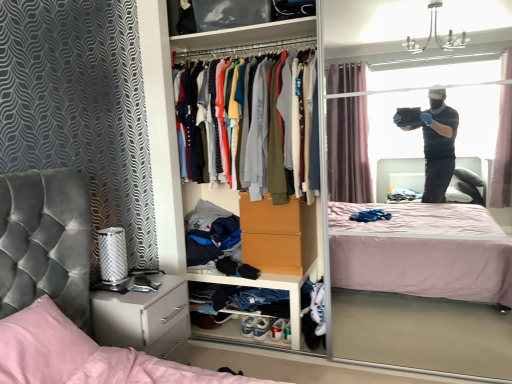
You are a GUI agent. You are given a task and a screenshot of the screen. Output one action in this format:
    pyautogui.click(x=<x>, y=<y>)
    Task: Click on the free point in front of white leather sneakers at lower center, arranged as the 1th footwear when viewed from the left
    This screenshot has height=384, width=512.
    Given the screenshot: What is the action you would take?
    pyautogui.click(x=248, y=349)